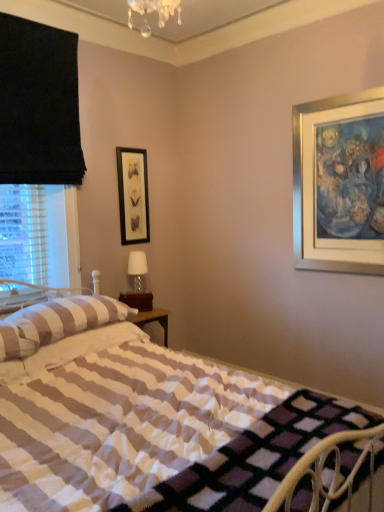
Question: Is striped fabric pillow at left inside the boundaries of black matte picture frame at upper center, or outside?

Choices:
 (A) inside
 (B) outside

Answer: (B)

Question: From their relative heights in the image, would you say striped fabric pillow at left is taller or shorter than black matte picture frame at upper center?

Choices:
 (A) tall
 (B) short

Answer: (B)

Question: Which is nearer to the black matte picture frame at upper center?

Choices:
 (A) striped fabric pillow at left
 (B) white matte table lamp at center
 (C) white striped fabric bed at center

Answer: (B)

Question: Considering the real-world distances, which object is farthest from the white matte table lamp at center?

Choices:
 (A) black matte picture frame at upper center
 (B) striped fabric pillow at left
 (C) white striped fabric bed at center

Answer: (C)